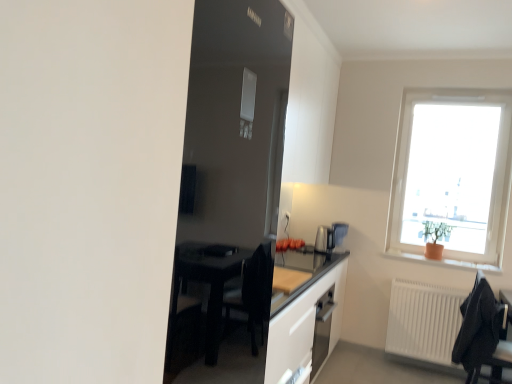
Question: From the image's perspective, would you say orange clay pot at right is shown under transparent glass window at upper right?

Choices:
 (A) no
 (B) yes

Answer: (B)

Question: Is orange clay pot at right oriented towards transparent glass window at upper right?

Choices:
 (A) yes
 (B) no

Answer: (B)

Question: Does orange clay pot at right have a lesser height compared to transparent glass window at upper right?

Choices:
 (A) no
 (B) yes

Answer: (B)

Question: Does orange clay pot at right touch transparent glass window at upper right?

Choices:
 (A) no
 (B) yes

Answer: (A)

Question: From a real-world perspective, is orange clay pot at right beneath transparent glass window at upper right?

Choices:
 (A) yes
 (B) no

Answer: (A)

Question: Considering their positions, is transparent glass window at upper right located in front of or behind orange clay pot at right?

Choices:
 (A) front
 (B) behind

Answer: (B)

Question: Considering the positions of transparent glass window at upper right and orange clay pot at right in the image, is transparent glass window at upper right bigger or smaller than orange clay pot at right?

Choices:
 (A) small
 (B) big

Answer: (B)

Question: Considering the positions of transparent glass window at upper right and orange clay pot at right in the image, is transparent glass window at upper right wider or thinner than orange clay pot at right?

Choices:
 (A) wide
 (B) thin

Answer: (A)

Question: Considering the positions of point (488, 228) and point (501, 264), is point (488, 228) closer or farther from the camera than point (501, 264)?

Choices:
 (A) farther
 (B) closer

Answer: (A)

Question: Is orange clay pot at right wider or thinner than black fabric chair at lower right?

Choices:
 (A) wide
 (B) thin

Answer: (B)

Question: Choose the correct answer: Is orange clay pot at right inside black fabric chair at lower right or outside it?

Choices:
 (A) inside
 (B) outside

Answer: (B)

Question: Considering the positions of orange clay pot at right and black fabric chair at lower right in the image, is orange clay pot at right taller or shorter than black fabric chair at lower right?

Choices:
 (A) tall
 (B) short

Answer: (B)

Question: Does point (411, 258) appear closer or farther from the camera than point (468, 344)?

Choices:
 (A) farther
 (B) closer

Answer: (A)

Question: Looking at their shapes, would you say white matte radiator at lower right is wider or thinner than transparent glass window at upper right?

Choices:
 (A) wide
 (B) thin

Answer: (B)

Question: Is white matte radiator at lower right in front of or behind transparent glass window at upper right in the image?

Choices:
 (A) behind
 (B) front

Answer: (B)